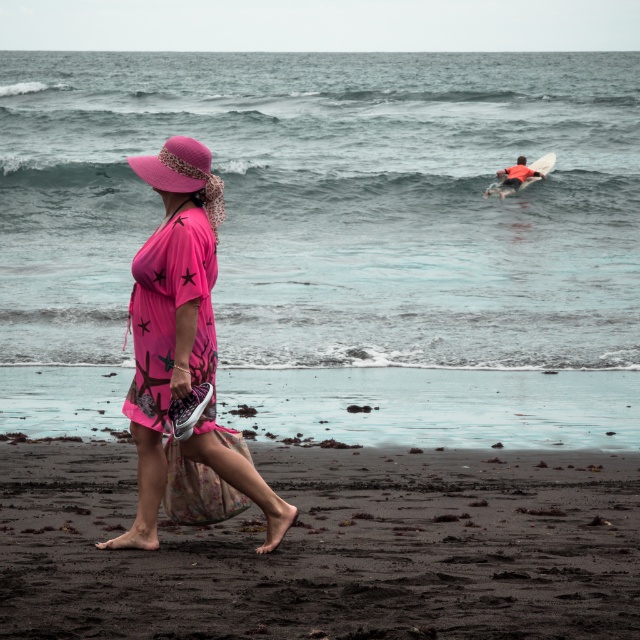
Locate an element on the screen. The width and height of the screenshot is (640, 640). clear blue water at center is located at coordinates (332, 204).

Does clear blue water at center have a greater height compared to red-orange wetsuit at upper right?

Yes, clear blue water at center is taller than red-orange wetsuit at upper right.

You are a GUI agent. You are given a task and a screenshot of the screen. Output one action in this format:
    pyautogui.click(x=<x>, y=<y>)
    Task: Click on the clear blue water at center
    Image resolution: width=640 pixels, height=640 pixels.
    Given the screenshot: What is the action you would take?
    tap(332, 204)

I want to click on clear blue water at center, so click(332, 204).

Who is more distant from viewer, (284, 339) or (140, 442)?

The point (284, 339) is more distant.

Does clear blue water at center appear on the left side of pink matte dress at center?

Incorrect, clear blue water at center is not on the left side of pink matte dress at center.

What do you see at coordinates (332, 204) in the screenshot? I see `clear blue water at center` at bounding box center [332, 204].

The width and height of the screenshot is (640, 640). Identify the location of clear blue water at center. (332, 204).

Does pink fabric hat at left appear over orange foam surfboard at upper right?

Incorrect, pink fabric hat at left is not positioned above orange foam surfboard at upper right.

Who is more distant from viewer, (172,157) or (545,164)?

The point (545,164) is more distant.

Who is more forward, (192, 192) or (544, 170)?

Point (192, 192)

Locate an element on the screen. pink fabric hat at left is located at coordinates (173, 168).